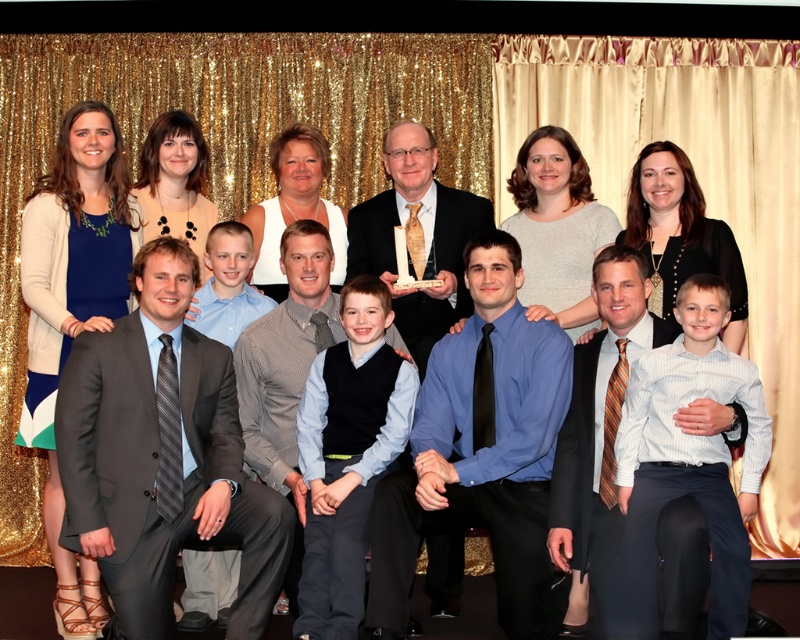
Question: Which point is farther to the camera?

Choices:
 (A) gray suit at center
 (B) gray textured suit at center
 (C) striped tie at center

Answer: (B)

Question: Which object is positioned closest to the gray textured suit at center?

Choices:
 (A) striped tie at center
 (B) matte black suit at center
 (C) blue satin shirt at center

Answer: (B)

Question: Can you confirm if gray suit at center is smaller than matte black suit at center?

Choices:
 (A) no
 (B) yes

Answer: (A)

Question: Which point appears closest to the camera in this image?

Choices:
 (A) (134, 342)
 (B) (454, 360)
 (C) (592, 396)
 (D) (266, 348)

Answer: (A)

Question: Does gray suit at center have a greater width compared to striped tie at center?

Choices:
 (A) no
 (B) yes

Answer: (B)

Question: Can you confirm if blue satin shirt at center is positioned to the right of gray textured suit at center?

Choices:
 (A) no
 (B) yes

Answer: (B)